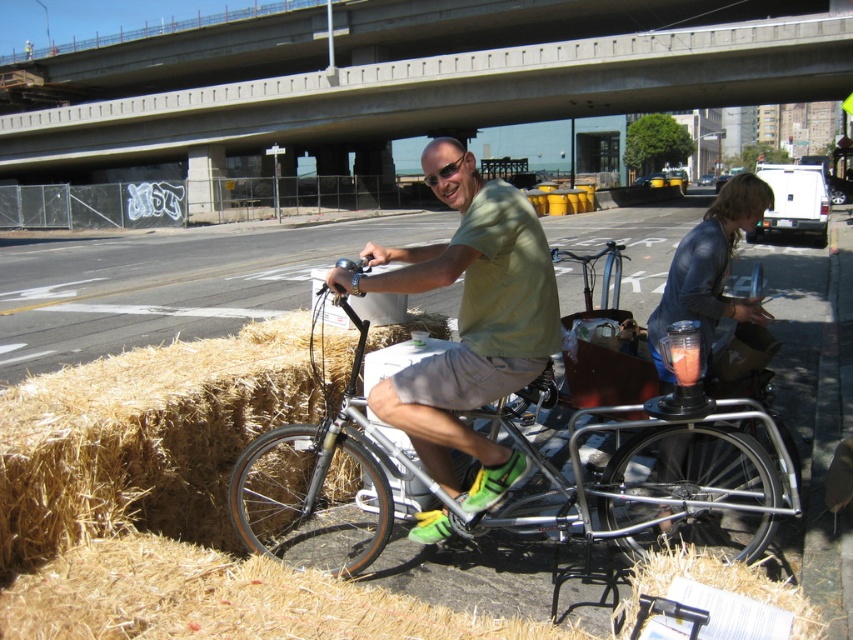
From the picture: Can you confirm if brown hay bales at lower left is bigger than translucent plastic cup at center?

Correct, brown hay bales at lower left is larger in size than translucent plastic cup at center.

Does brown hay bales at lower left come in front of translucent plastic cup at center?

No.

Locate an element on the screen. brown hay bales at lower left is located at coordinates (165, 285).

Is concrete at upper center to the left of silver metallic bicycle at center from the viewer's perspective?

Indeed, concrete at upper center is positioned on the left side of silver metallic bicycle at center.

Does concrete at upper center have a lesser height compared to silver metallic bicycle at center?

Incorrect, concrete at upper center's height does not fall short of silver metallic bicycle at center's.

Image resolution: width=853 pixels, height=640 pixels. What do you see at coordinates (421, 81) in the screenshot?
I see `concrete at upper center` at bounding box center [421, 81].

Find the location of `concrete at upper center`. concrete at upper center is located at coordinates coord(421,81).

Where is `green matte shirt at center`? The width and height of the screenshot is (853, 640). green matte shirt at center is located at coordinates (469, 324).

Which is above, green matte shirt at center or translucent plastic cup at center?

translucent plastic cup at center is higher up.

Locate an element on the screen. green matte shirt at center is located at coordinates (469, 324).